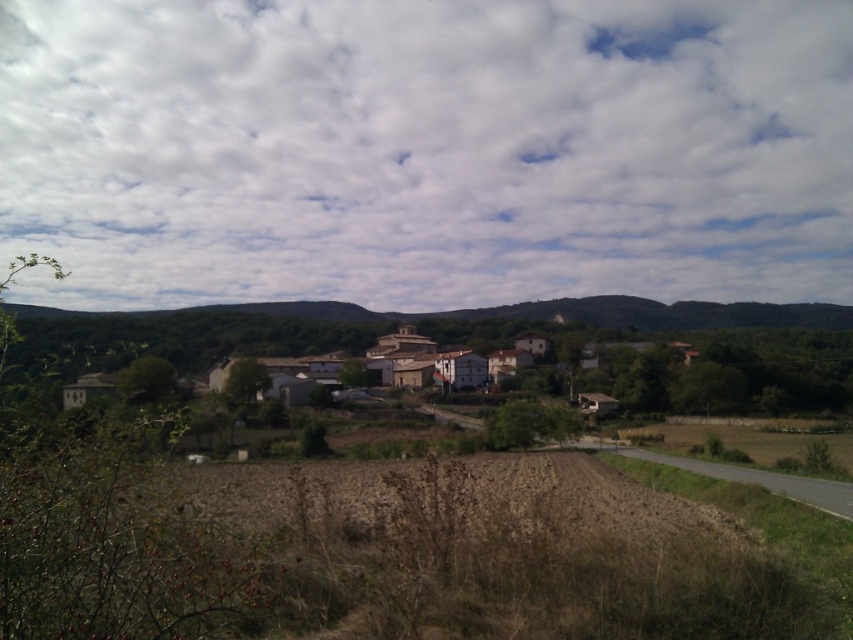
Is white fluffy clouds at upper center shorter than white stucco village at center?

No.

In the scene shown: Can you confirm if white fluffy clouds at upper center is bigger than white stucco village at center?

Yes.

Is point (267, 296) farther from viewer compared to point (544, 344)?

That is True.

I want to click on white fluffy clouds at upper center, so click(x=426, y=150).